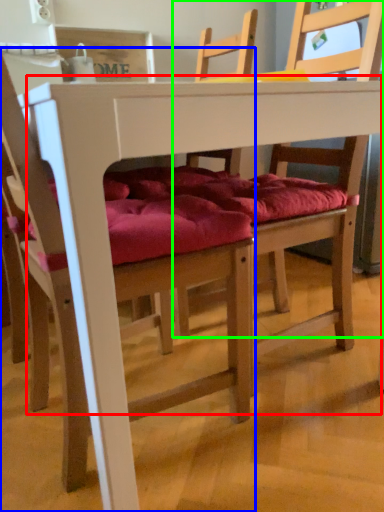
Question: Which object is the farthest from table (highlighted by a red box)? Choose among these: chair (highlighted by a blue box) or chair (highlighted by a green box).

Choices:
 (A) chair
 (B) chair

Answer: (B)